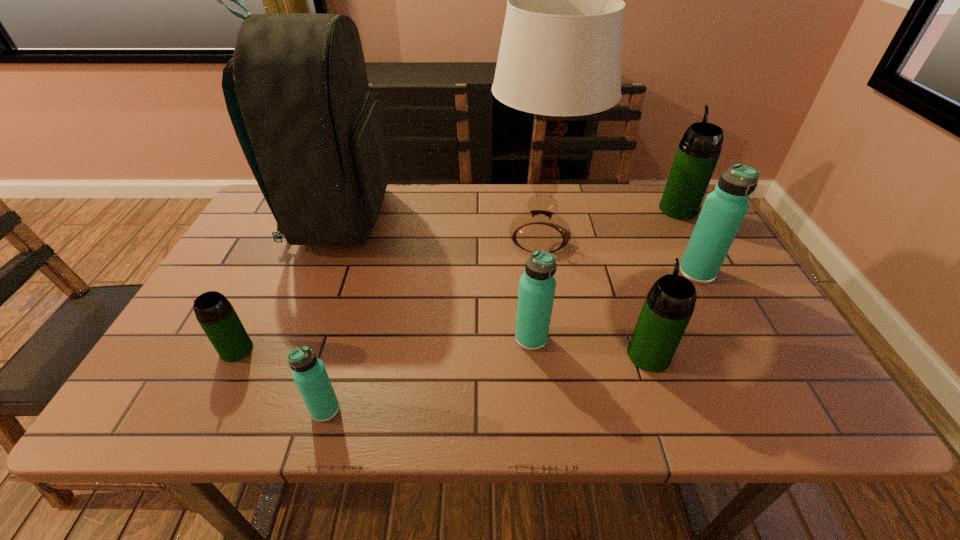
In order to click on backpack in this screenshot , I will do `click(311, 131)`.

Locate an element on the screen. table lamp is located at coordinates (560, 55).

The width and height of the screenshot is (960, 540). Find the location of `the biggest green thermos bottle`. the biggest green thermos bottle is located at coordinates (698, 152).

Locate an element on the screen. the farthest thermos bottle is located at coordinates (698, 152).

Where is `the farthest aqua thermos bottle`? the farthest aqua thermos bottle is located at coordinates (724, 209).

Where is `the second farthest thermos bottle`? Image resolution: width=960 pixels, height=540 pixels. the second farthest thermos bottle is located at coordinates (724, 209).

The image size is (960, 540). I want to click on the second smallest green thermos bottle, so click(x=669, y=305).

Locate an element on the screen. The image size is (960, 540). the fourth thermos bottle from left to right is located at coordinates (669, 305).

The height and width of the screenshot is (540, 960). In order to click on the second aqua thermos bottle from right to left in this screenshot , I will do `click(537, 285)`.

Locate an element on the screen. The width and height of the screenshot is (960, 540). the third thermos bottle from left to right is located at coordinates (537, 285).